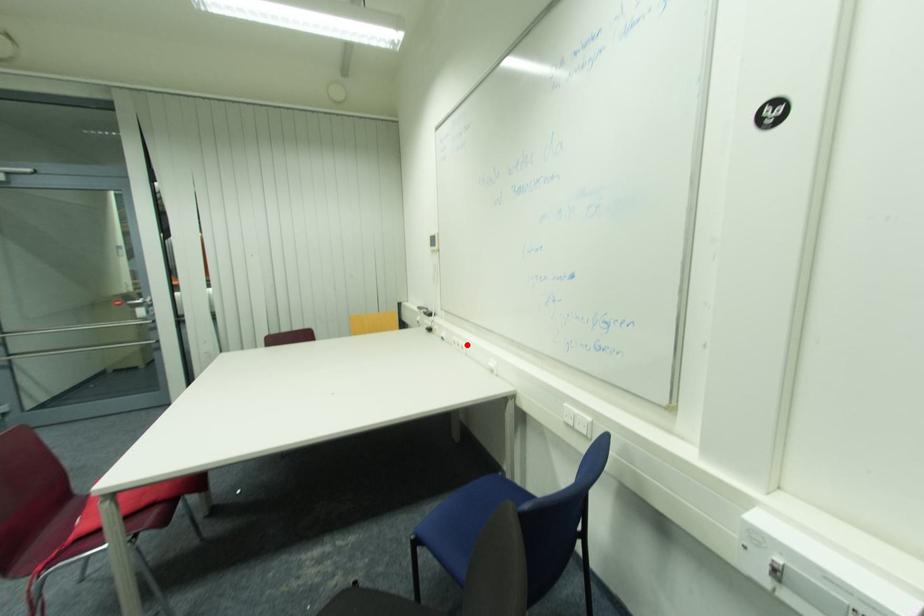
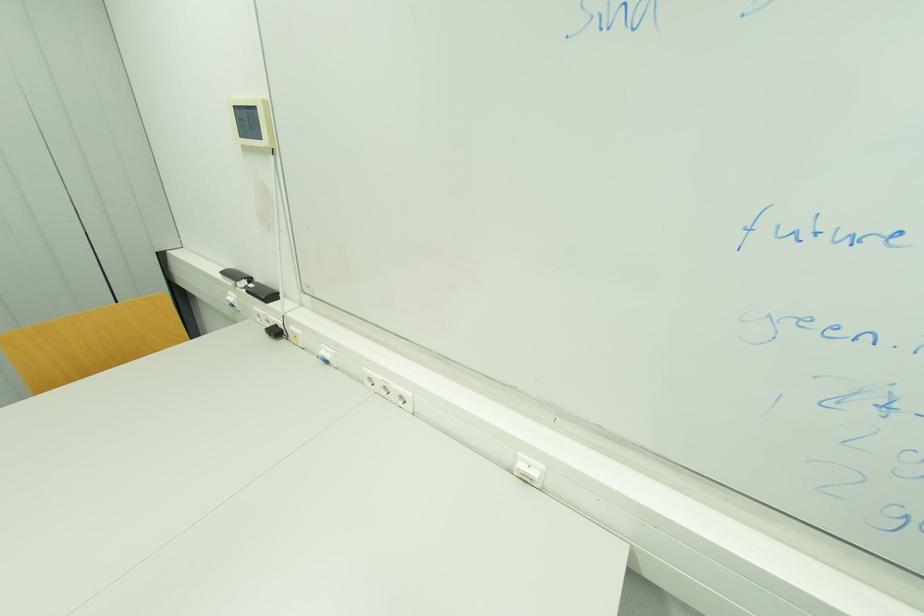
Find the pixel in the second image that matches the highlighted location in the first image.

(409, 394)